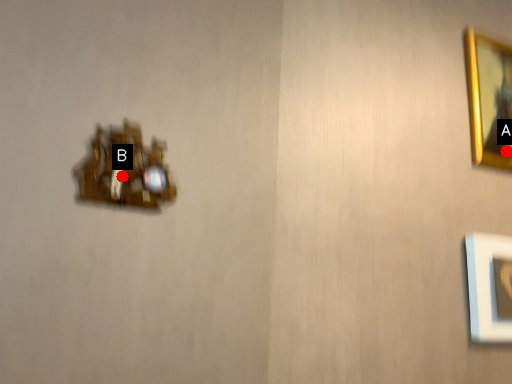
Question: Two points are circled on the image, labeled by A and B beside each circle. Which point appears farthest from the camera in this image?

Choices:
 (A) A is further
 (B) B is further

Answer: (A)